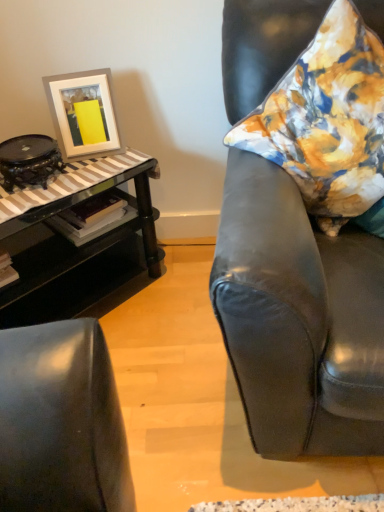
Question: Considering the relative positions of black glass table at left and matte black armchair at right in the image provided, is black glass table at left to the left or to the right of matte black armchair at right?

Choices:
 (A) right
 (B) left

Answer: (B)

Question: Does point (46, 225) appear closer or farther from the camera than point (332, 268)?

Choices:
 (A) farther
 (B) closer

Answer: (A)

Question: Estimate the real-world distances between objects in this image. Which object is farther from the white matte picture frame at upper left?

Choices:
 (A) floral fabric pillow at right
 (B) matte black armchair at right
 (C) black glass table at left

Answer: (B)

Question: Which of these objects is positioned farthest from the matte black armchair at right?

Choices:
 (A) white matte picture frame at upper left
 (B) black glass table at left
 (C) floral fabric pillow at right

Answer: (A)